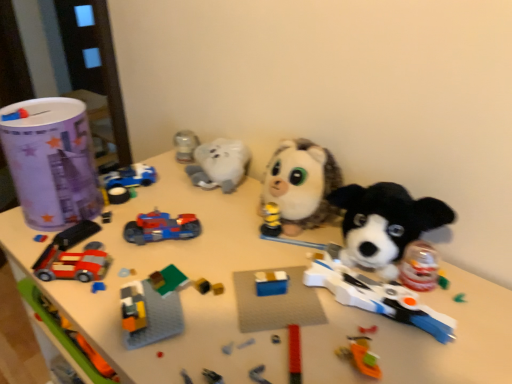
Locate an element on the screen. The height and width of the screenshot is (384, 512). vacant space in between shiny plastic toy car at center, the fourth toy positioned from the left, and fluffy white plush at center, placed as the 5th toy when sorted from left to right is located at coordinates (225, 231).